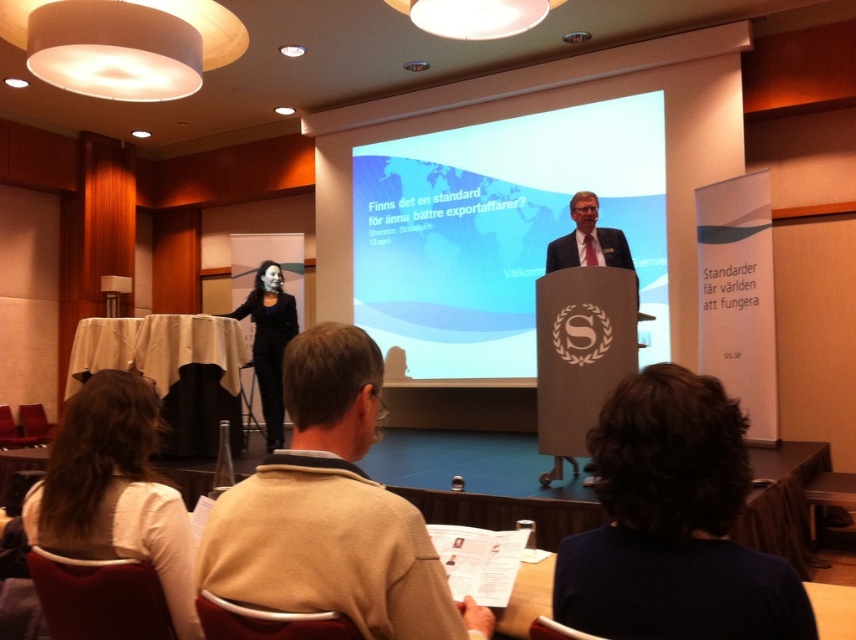
Which is more to the left, dark blue sweater at lower right or white fabric shirt at lower left?

white fabric shirt at lower left

Which of these two, dark blue sweater at lower right or white fabric shirt at lower left, stands taller?

Standing taller between the two is white fabric shirt at lower left.

Between point (605, 412) and point (94, 500), which one is positioned in front?

Positioned in front is point (605, 412).

The width and height of the screenshot is (856, 640). I want to click on dark blue sweater at lower right, so click(673, 524).

Does matte blue projector screen at center have a smaller size compared to light brown wood podium at center?

No, matte blue projector screen at center is not smaller than light brown wood podium at center.

Can you confirm if matte blue projector screen at center is positioned to the right of light brown wood podium at center?

No, matte blue projector screen at center is not to the right of light brown wood podium at center.

Which is behind, point (619, 141) or point (551, 269)?

The point (619, 141) is behind.

The height and width of the screenshot is (640, 856). I want to click on matte blue projector screen at center, so click(x=498, y=228).

Is point (632, 177) behind point (271, 273)?

Yes, point (632, 177) is farther from viewer.

Who is lower down, matte blue projector screen at center or black fabric dress at center?

black fabric dress at center

The height and width of the screenshot is (640, 856). I want to click on matte blue projector screen at center, so click(498, 228).

This screenshot has width=856, height=640. I want to click on matte blue projector screen at center, so click(498, 228).